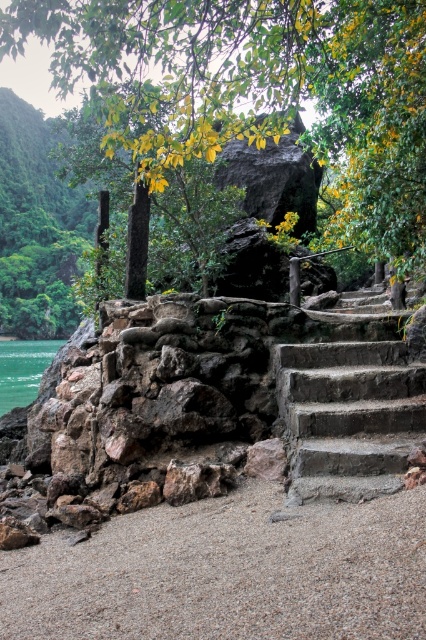
Question: Which point is farther from the camera taking this photo?

Choices:
 (A) (152, 116)
 (B) (371, 445)

Answer: (A)

Question: Which point is closer to the camera?

Choices:
 (A) (290, 611)
 (B) (357, 129)
 (C) (359, 387)

Answer: (A)

Question: Is green leafy tree at upper center further to camera compared to dark gray concrete stairs at right?

Choices:
 (A) no
 (B) yes

Answer: (B)

Question: Can you confirm if green leafy tree at upper center is positioned to the right of dark gray concrete stairs at right?

Choices:
 (A) no
 (B) yes

Answer: (A)

Question: Which point is farther from the camera taking this photo?

Choices:
 (A) (360, 108)
 (B) (287, 346)
 (C) (408, 611)

Answer: (A)

Question: Can you confirm if smooth sand at lower center is positioned to the left of dark gray concrete stairs at right?

Choices:
 (A) no
 (B) yes

Answer: (B)